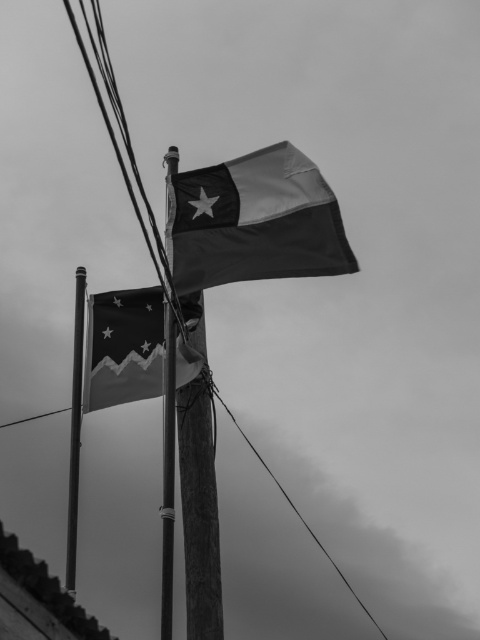
Question: Can you confirm if matte black flag at lower left is wider than wooden pole at center?

Choices:
 (A) no
 (B) yes

Answer: (B)

Question: Among these points, which one is farthest from the camera?

Choices:
 (A) (87, 332)
 (B) (79, 356)
 (C) (332, 273)

Answer: (A)

Question: Among these points, which one is nearest to the camera?

Choices:
 (A) (171, 506)
 (B) (75, 276)

Answer: (A)

Question: Which of the following is the closest to the observer?

Choices:
 (A) (263, 196)
 (B) (167, 556)

Answer: (B)

Question: Can you confirm if matte black flag at lower left is positioned to the right of smooth wire at center?

Choices:
 (A) yes
 (B) no

Answer: (B)

Question: Does silky black flag at upper center come behind smooth wire at center?

Choices:
 (A) no
 (B) yes

Answer: (A)